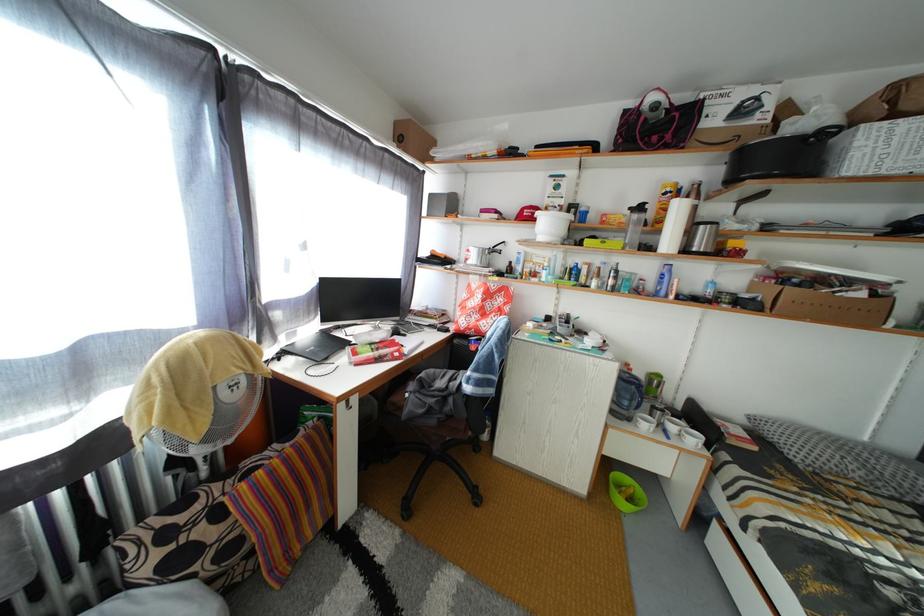
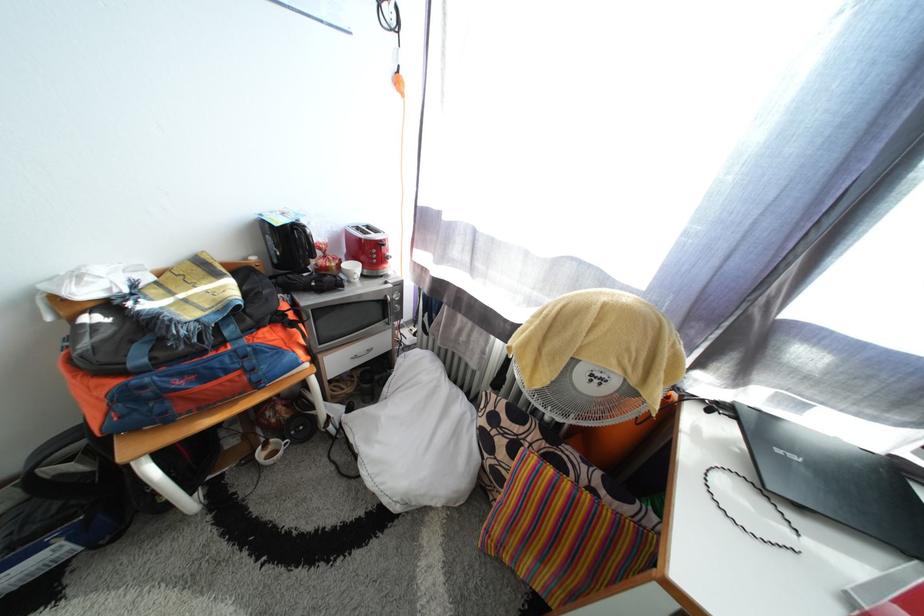
Where in the second image is the point corresponding to (x=281, y=479) from the first image?

(563, 493)